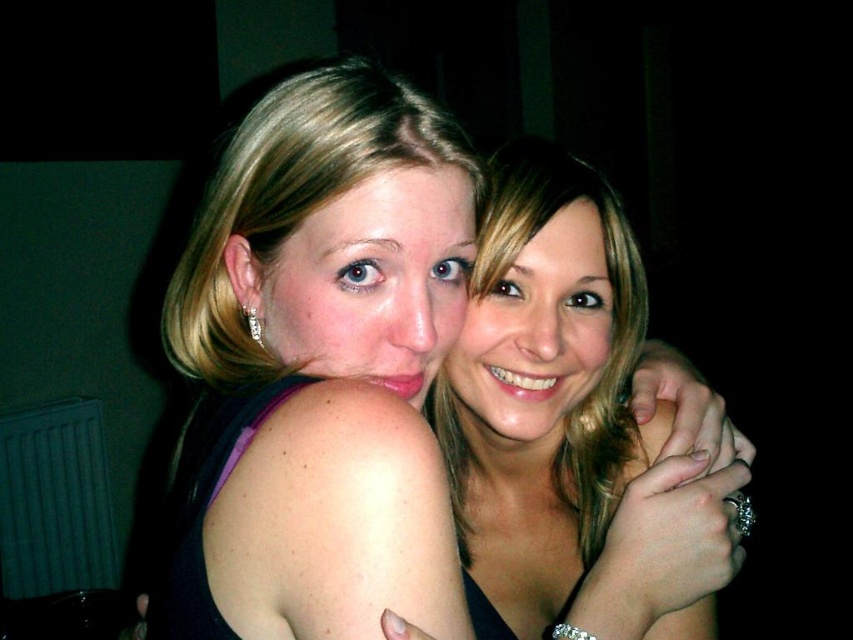
You are a photographer trying to adjust the lighting for a photo shoot. You have a spotlight that can only illuminate objects wider than 30 cm. Based on the scene, can the spotlight effectively illuminate the matte black dress at center and the smooth skin face at center?

The matte black dress at center might be wider than smooth skin face at center. Since the spotlight requires objects wider than 30 cm, but we don not know the exact width of either object, it is uncertain whether the spotlight will work. Further measurements are needed.

You are a photographer trying to adjust the lighting for a photo shoot. You notice the matte black dress at center and the smooth skin face at center. Which object should you focus the light on to ensure proper exposure, considering one is in front of the other?

The matte black dress at center is in front of the smooth skin face at center, so you should focus the light on the matte black dress at center to ensure proper exposure.

You are a photographer trying to focus on the smooth skin face at center in the image. However, the matte black dress at center is blocking part of the face. Can you adjust your camera angle to the right to avoid the dress?

The matte black dress at center is to the left of the smooth skin face at center, so adjusting the camera angle to the right would move the dress further away from the face, allowing you to focus on the smooth skin face at center without obstruction.